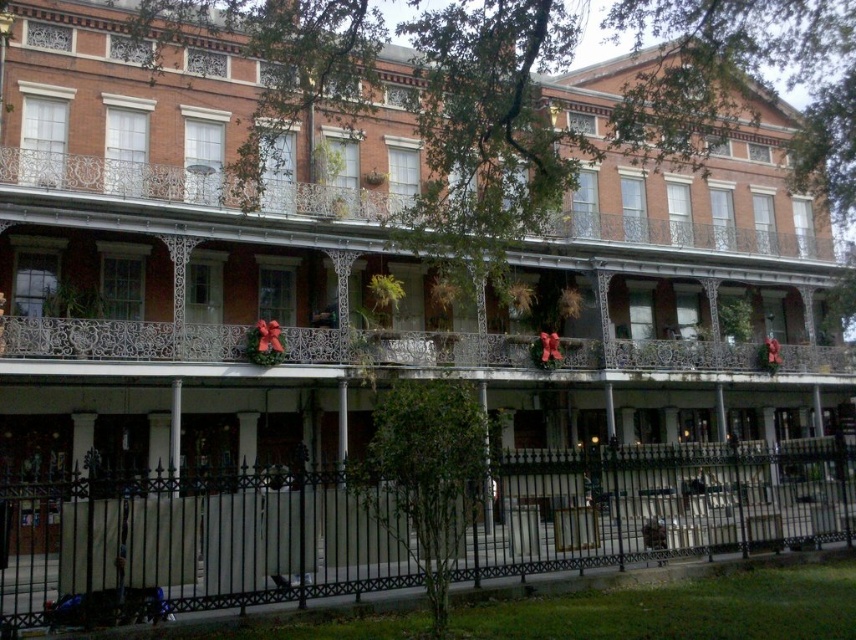
Question: Which point is farther to the camera?

Choices:
 (A) (557, 522)
 (B) (18, 204)

Answer: (B)

Question: Which object is closer to the camera taking this photo?

Choices:
 (A) iron/black fence at lower center
 (B) metallic wrought iron balcony at center

Answer: (A)

Question: Does iron/black fence at lower center have a larger size compared to metallic wrought iron balcony at center?

Choices:
 (A) yes
 (B) no

Answer: (B)

Question: Can you confirm if iron/black fence at lower center is bigger than metallic wrought iron balcony at center?

Choices:
 (A) no
 (B) yes

Answer: (A)

Question: From the image, what is the correct spatial relationship of iron/black fence at lower center in relation to metallic wrought iron balcony at center?

Choices:
 (A) below
 (B) above

Answer: (A)

Question: Which point is farther to the camera?

Choices:
 (A) metallic wrought iron balcony at center
 (B) iron/black fence at lower center

Answer: (A)